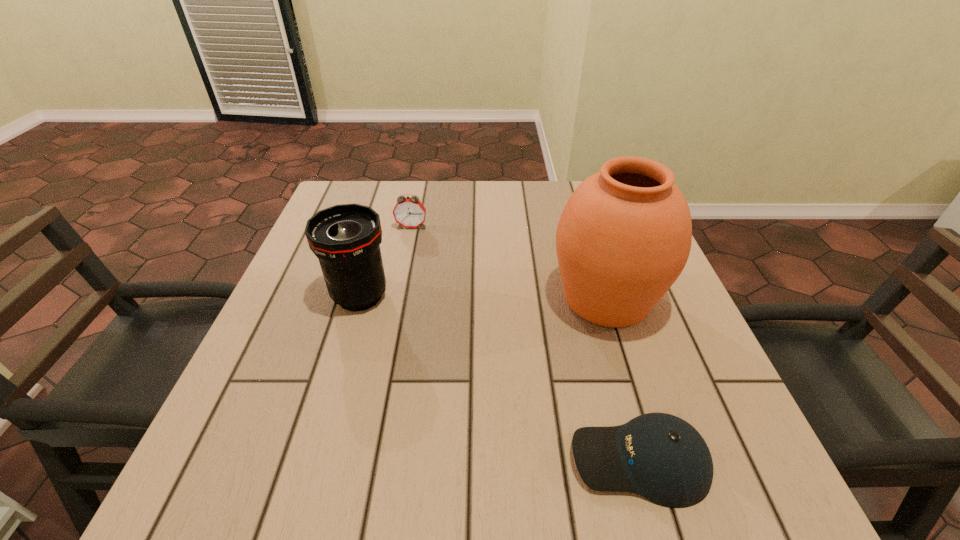
At what (x,y) coordinates should I click in order to perform the action: click on urn. Please return your answer as a coordinate pair (x, y). Image resolution: width=960 pixels, height=540 pixels. Looking at the image, I should click on (624, 237).

Where is `telephoto lens`? telephoto lens is located at coordinates (346, 238).

What are the coordinates of `the third tallest object` in the screenshot? It's located at (408, 212).

The width and height of the screenshot is (960, 540). Find the location of `the farthest object`. the farthest object is located at coordinates (408, 212).

The image size is (960, 540). I want to click on the shortest object, so click(659, 456).

Find the location of a particular element. the nearest object is located at coordinates (659, 456).

I want to click on vacant position located on the left of the urn, so click(x=416, y=298).

Find the location of a particular element. The width and height of the screenshot is (960, 540). blank space located 0.140m on the right of the third shortest object is located at coordinates (458, 296).

Where is `vacant space located on the clock face of the third tallest object`? The image size is (960, 540). vacant space located on the clock face of the third tallest object is located at coordinates (391, 331).

Find the location of a particular element. The width and height of the screenshot is (960, 540). free spot located 0.270m on the front-facing side of the baseball cap is located at coordinates (392, 461).